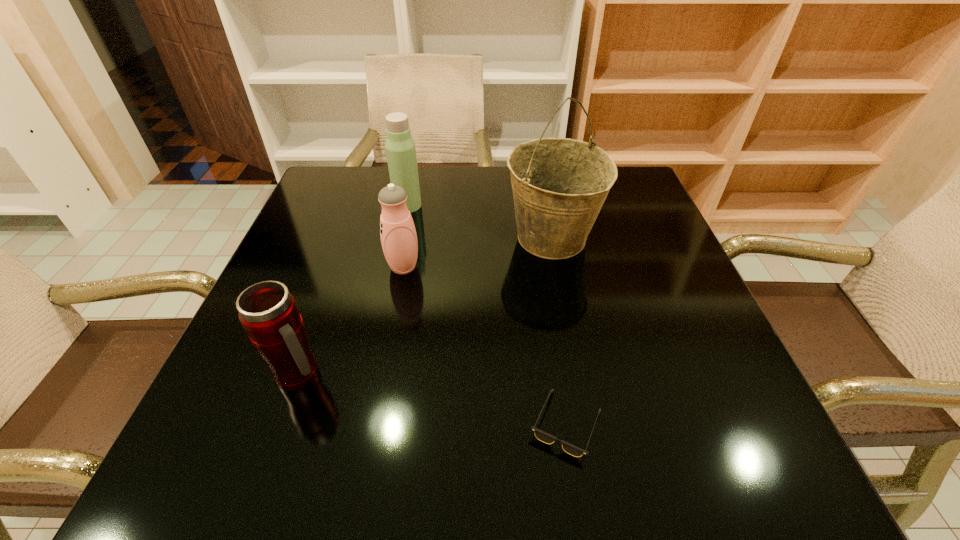
Locate an element on the screen. wine bucket that is at the far edge is located at coordinates (559, 185).

Identify the location of thermos bottle situated at the far edge. (400, 147).

Where is `object located in the near edge section of the desktop`? The width and height of the screenshot is (960, 540). object located in the near edge section of the desktop is located at coordinates (573, 450).

The width and height of the screenshot is (960, 540). I want to click on object that is at the left edge, so click(x=268, y=312).

Where is `object at the right edge`? The image size is (960, 540). object at the right edge is located at coordinates (559, 185).

You are a GUI agent. You are given a task and a screenshot of the screen. Output one action in this format:
    pyautogui.click(x=<x>, y=<y>)
    Task: Click on the object that is at the far right corner
    Image resolution: width=960 pixels, height=540 pixels.
    Given the screenshot: What is the action you would take?
    pyautogui.click(x=559, y=185)

Where is `vacant space at the far edge of the desktop`? The image size is (960, 540). vacant space at the far edge of the desktop is located at coordinates (462, 181).

I want to click on vacant position at the near edge of the desktop, so click(455, 462).

Identify the location of vacant position at the left edge of the desktop. (278, 261).

You are a GUI agent. You are given a task and a screenshot of the screen. Output one action in this format:
    pyautogui.click(x=<x>, y=<y>)
    Task: Click on the free space at the far left corner
    This screenshot has width=960, height=540.
    Given the screenshot: What is the action you would take?
    pyautogui.click(x=318, y=214)